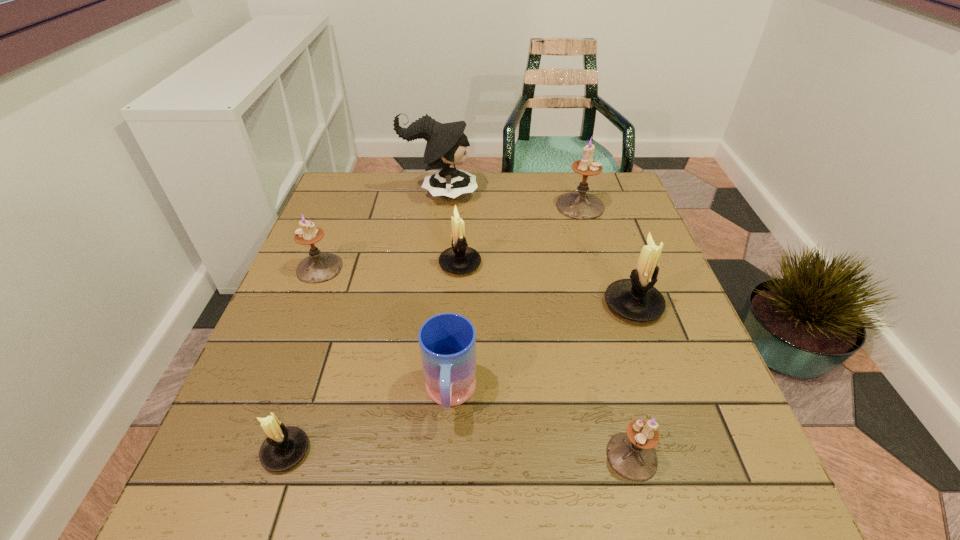
This screenshot has height=540, width=960. I want to click on object that stands as the fourth closest to the tallest object, so click(x=635, y=299).

Image resolution: width=960 pixels, height=540 pixels. In order to click on object that is the sixth nearest to the tallest object in this screenshot , I will do `click(284, 447)`.

Identify the location of the fifth closest candle holder to the rightmost white candle holder. (318, 267).

Identify which candle holder is the sixth nearest to the mug. Please provide its 2D coordinates. Your answer should be formatted as a tuple, i.e. [(x, y)], where the tuple contains the x and y coordinates of a point satisfying the conditions above.

[(580, 205)]

Point out which purple candle holder is positioned as the second nearest to the smallest white candle holder. Please provide its 2D coordinates. Your answer should be formatted as a tuple, i.e. [(x, y)], where the tuple contains the x and y coordinates of a point satisfying the conditions above.

[(631, 454)]

Locate an element on the screen. Image resolution: width=960 pixels, height=540 pixels. purple candle holder object that ranks as the second closest to the nearest purple candle holder is located at coordinates (318, 267).

You are a GUI agent. You are given a task and a screenshot of the screen. Output one action in this format:
    pyautogui.click(x=<x>, y=<y>)
    Task: Click on the white candle holder that is the third closest to the nearest purple candle holder
    This screenshot has width=960, height=540.
    Given the screenshot: What is the action you would take?
    pyautogui.click(x=284, y=447)

Locate which white candle holder ranks third in proximity to the farthest purple candle holder. Please provide its 2D coordinates. Your answer should be formatted as a tuple, i.e. [(x, y)], where the tuple contains the x and y coordinates of a point satisfying the conditions above.

[(284, 447)]

Where is `free spot that satisfies the following two spatial constraints: 1. on the front side of the nearest white candle holder; 2. on the right side of the leftmost purple candle holder`? This screenshot has height=540, width=960. free spot that satisfies the following two spatial constraints: 1. on the front side of the nearest white candle holder; 2. on the right side of the leftmost purple candle holder is located at coordinates 247,451.

The image size is (960, 540). What are the coordinates of `vacant space that satisfies the following two spatial constraints: 1. at the face of the farthest purple candle holder; 2. on the left side of the tallest object` in the screenshot? It's located at (439, 206).